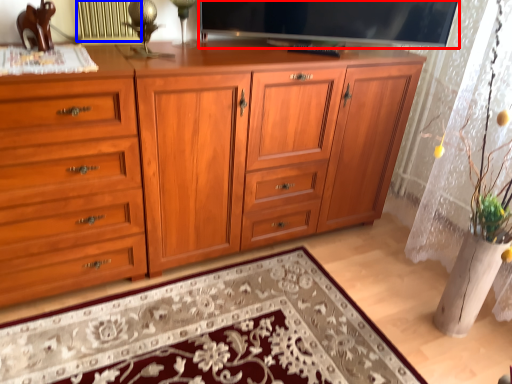
Question: Among these objects, which one is farthest to the camera, television (highlighted by a red box) or radiator (highlighted by a blue box)?

Choices:
 (A) television
 (B) radiator

Answer: (A)